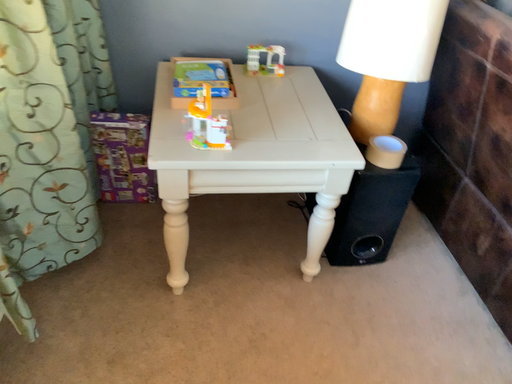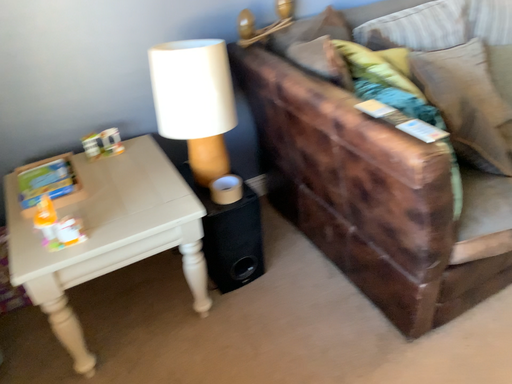
Question: Which way did the camera rotate in the video?

Choices:
 (A) rotated right
 (B) rotated left

Answer: (A)